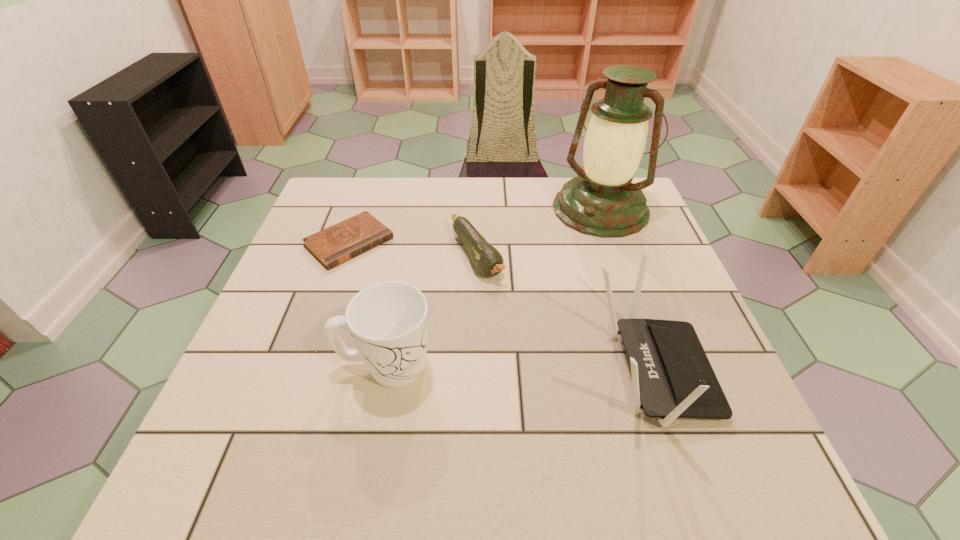
The image size is (960, 540). Identify the location of vacant space located at the blossom end of the second shortest object. (535, 362).

I want to click on blank area located at the blossom end of the second shortest object, so click(x=509, y=320).

In order to click on vacant space located 0.310m at the blossom end of the second shortest object in this screenshot , I will do `click(552, 390)`.

You are a GUI agent. You are given a task and a screenshot of the screen. Output one action in this format:
    pyautogui.click(x=<x>, y=<y>)
    Task: Click on the vacant space located with the light compartment facing forward on the tallest object
    The width and height of the screenshot is (960, 540).
    Given the screenshot: What is the action you would take?
    pyautogui.click(x=556, y=269)

In order to click on free spot located with the light compartment facing forward on the tallest object in this screenshot , I will do `click(559, 265)`.

This screenshot has height=540, width=960. Find the location of `free space located with the light compartment facing forward on the tallest object`. free space located with the light compartment facing forward on the tallest object is located at coordinates (536, 297).

The image size is (960, 540). I want to click on diary present at the far edge, so click(332, 246).

Find the location of a particular element. lantern at the far edge is located at coordinates (602, 202).

The height and width of the screenshot is (540, 960). In order to click on mug at the near edge in this screenshot , I will do `click(388, 321)`.

Locate an element on the screen. The height and width of the screenshot is (540, 960). router positioned at the near edge is located at coordinates (671, 375).